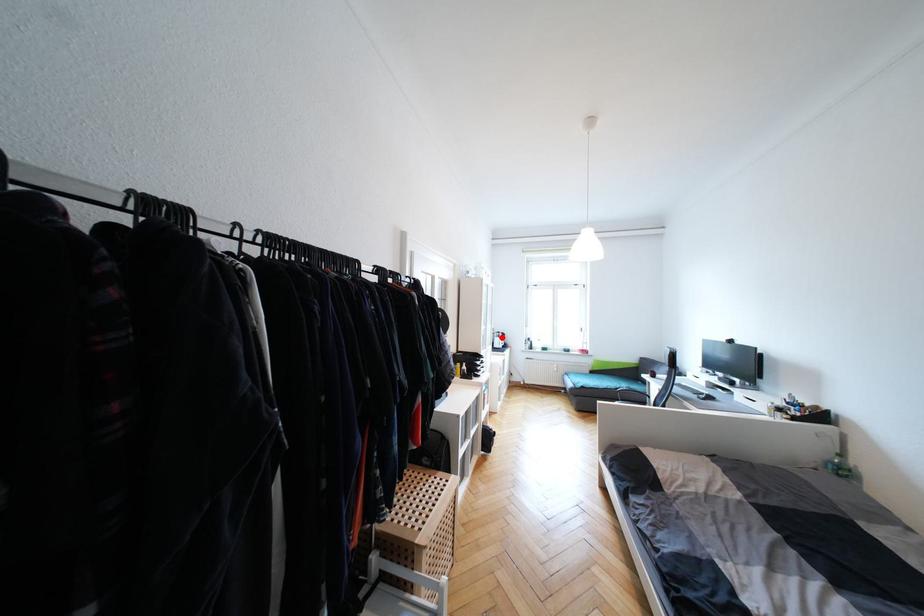
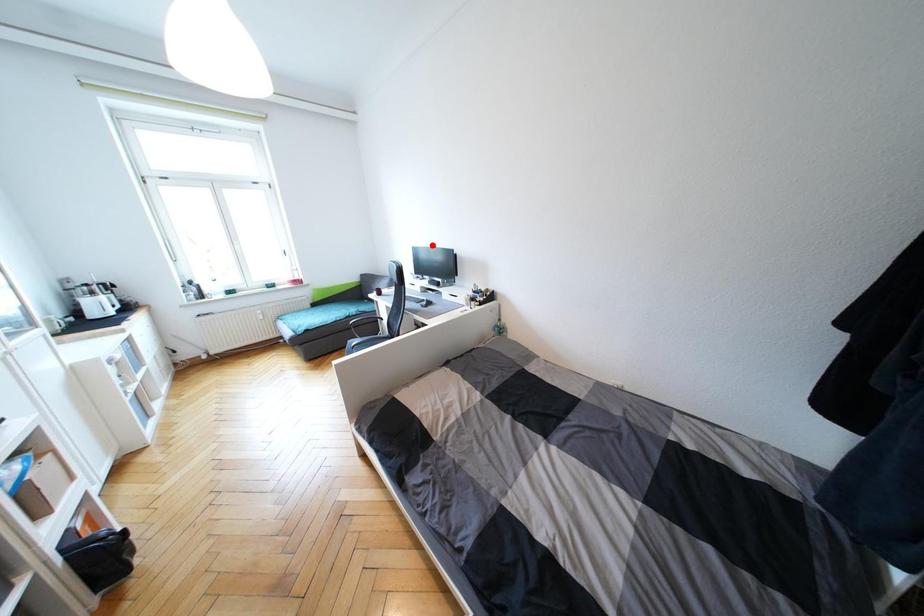
I am providing you with two images of the same scene from different viewpoints. A red point is marked on the first image and another point is marked on the second image. Are the points marked in image1 and image2 representing the same 3D position?

No